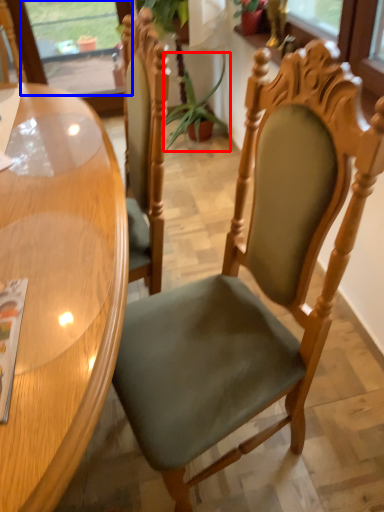
Question: Which object is closer to the camera taking this photo, plant (highlighted by a red box) or window screen (highlighted by a blue box)?

Choices:
 (A) plant
 (B) window screen

Answer: (A)